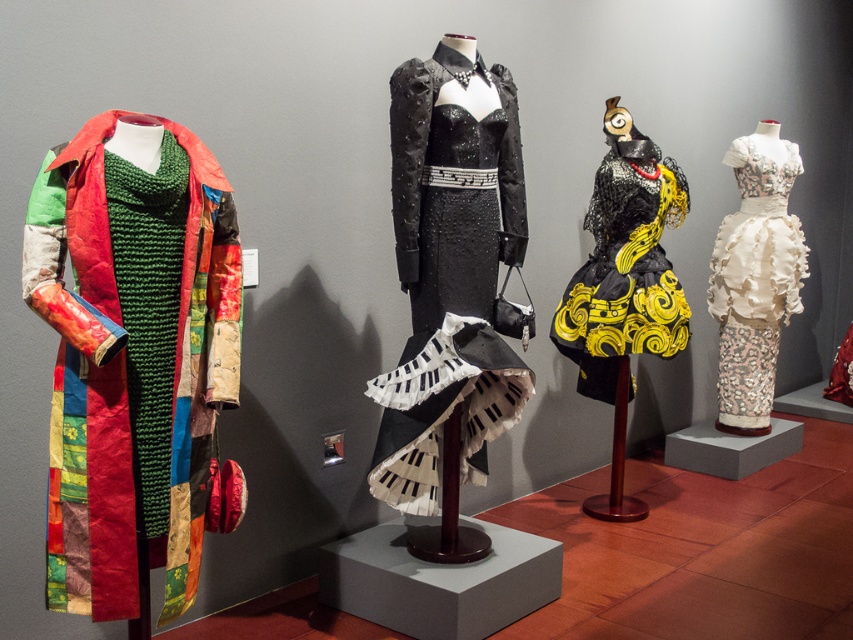
Can you confirm if black sequined dress at center is bigger than black textured dress at center?

Yes.

This screenshot has height=640, width=853. Describe the element at coordinates (450, 269) in the screenshot. I see `black sequined dress at center` at that location.

Where is `black sequined dress at center`? black sequined dress at center is located at coordinates (450, 269).

Is point (78, 500) less distant than point (779, 316)?

Yes, point (78, 500) is in front of point (779, 316).

This screenshot has height=640, width=853. What do you see at coordinates (132, 355) in the screenshot?
I see `patchwork fabric coat at left` at bounding box center [132, 355].

Which is behind, point (51, 504) or point (801, 248)?

Point (801, 248)

The width and height of the screenshot is (853, 640). Find the location of `patchwork fabric coat at left`. patchwork fabric coat at left is located at coordinates (132, 355).

Between black textured dress at center and white lace dress at upper right, which one is positioned lower?

black textured dress at center is lower down.

Find the location of a particular element. The width and height of the screenshot is (853, 640). black textured dress at center is located at coordinates (624, 272).